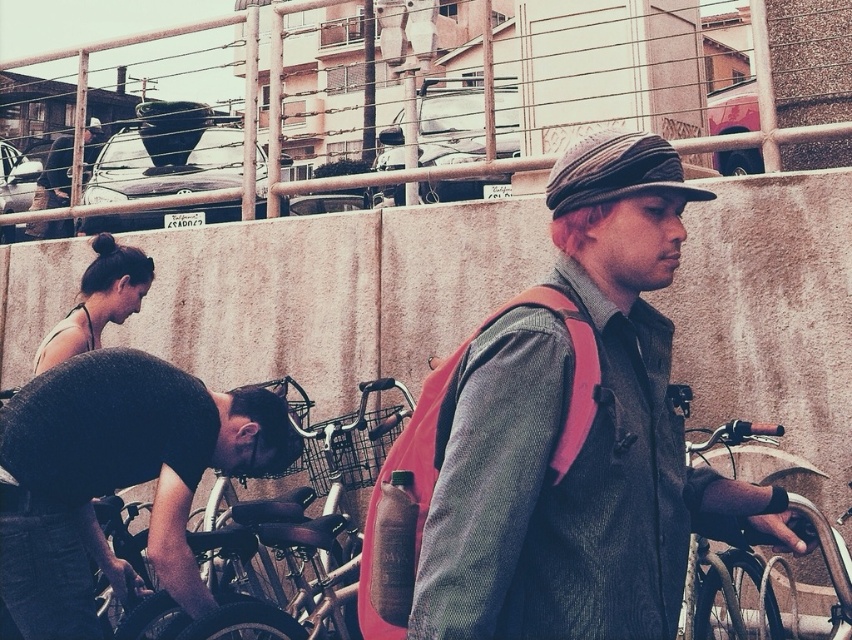
Can you confirm if matte black hair at upper left is taller than matte black backpack at upper left?

Yes.

Image resolution: width=852 pixels, height=640 pixels. I want to click on matte black hair at upper left, so click(x=98, y=300).

Does matte pink backpack at center have a greater height compared to matte black hair at upper left?

Yes, matte pink backpack at center is taller than matte black hair at upper left.

Who is taller, matte pink backpack at center or matte black hair at upper left?

Standing taller between the two is matte pink backpack at center.

Who is more distant from viewer, (538, 524) or (119, 276)?

Positioned behind is point (119, 276).

Find the location of a particular element. matte pink backpack at center is located at coordinates (566, 433).

Consider the image. Is matte pink backpack at center above matte black backpack at upper left?

Actually, matte pink backpack at center is below matte black backpack at upper left.

How much distance is there between matte pink backpack at center and matte black backpack at upper left?

10.55 meters

Who is more distant from viewer, (x=602, y=548) or (x=83, y=179)?

Point (x=83, y=179)

The height and width of the screenshot is (640, 852). I want to click on matte pink backpack at center, so coord(566,433).